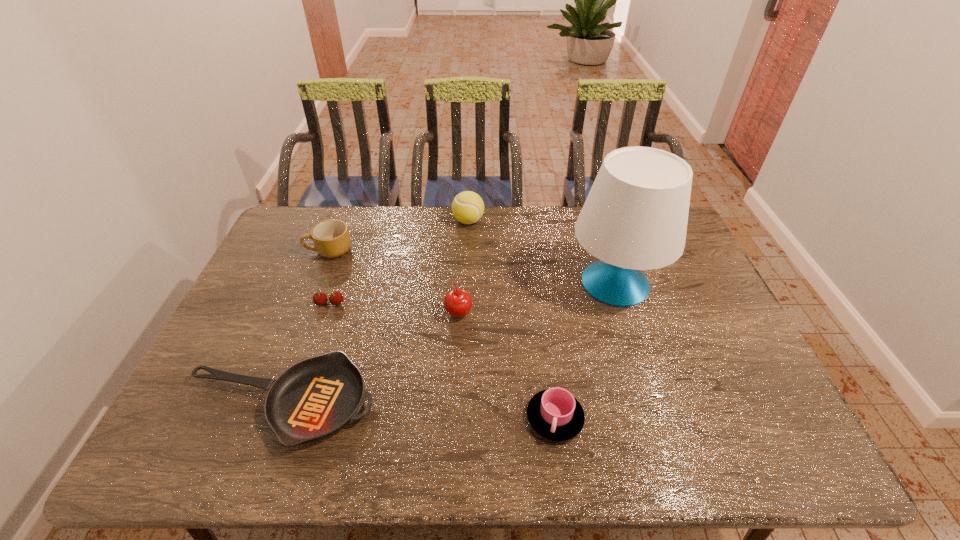
Where is `free space located 0.360m on the front-facing side of the tallest object`? free space located 0.360m on the front-facing side of the tallest object is located at coordinates (451, 283).

Find the location of a particular element. The height and width of the screenshot is (540, 960). vacant region located 0.390m on the front-facing side of the tallest object is located at coordinates (442, 283).

This screenshot has width=960, height=540. What are the coordinates of `free space located on the right of the farthest object` in the screenshot? It's located at (564, 221).

Where is `blank space located on the surface of the left cherry`? The image size is (960, 540). blank space located on the surface of the left cherry is located at coordinates (300, 392).

You are a GUI agent. You are given a task and a screenshot of the screen. Output one action in this format:
    pyautogui.click(x=<x>, y=<y>)
    Task: Click on the vacant area situated on the back of the right cherry
    The width and height of the screenshot is (960, 540).
    Given the screenshot: What is the action you would take?
    pyautogui.click(x=462, y=239)

I want to click on vacant region located 0.090m on the side with the handle of the third shortest object, so click(x=279, y=251).

The width and height of the screenshot is (960, 540). I want to click on free space located 0.120m on the side with the handle of the third shortest object, so pos(271,251).

This screenshot has width=960, height=540. What are the coordinates of `free location located 0.260m on the right of the shortest object` in the screenshot? It's located at (483, 403).

Where is `tennis ball at the far edge`? The image size is (960, 540). tennis ball at the far edge is located at coordinates (467, 207).

Locate an element on the screen. mug at the far edge is located at coordinates (x=331, y=238).